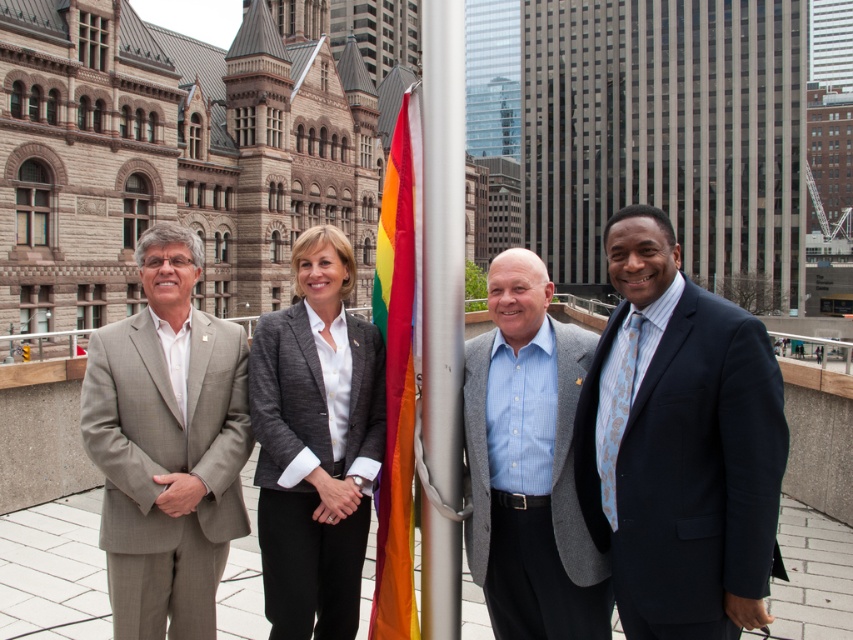
Does blue textured suit at right appear on the right side of brushed metal flag pole at center?

Yes, blue textured suit at right is to the right of brushed metal flag pole at center.

The width and height of the screenshot is (853, 640). In order to click on blue textured suit at right in this screenshot , I will do `click(679, 445)`.

Can you confirm if blue textured suit at right is wider than gray wool blazer at center?

Yes, blue textured suit at right is wider than gray wool blazer at center.

Is blue textured suit at right taller than gray wool blazer at center?

No.

Who is more forward, [666,589] or [354,509]?

Positioned in front is point [666,589].

Locate an element on the screen. The width and height of the screenshot is (853, 640). blue textured suit at right is located at coordinates tap(679, 445).

Is light brown suit at left bigger than rainbow fabric flag at center?

Correct, light brown suit at left is larger in size than rainbow fabric flag at center.

Who is more forward, (190, 316) or (403, 188)?

Positioned in front is point (403, 188).

Is point (175, 268) closer to viewer compared to point (387, 468)?

No.

The height and width of the screenshot is (640, 853). I want to click on light brown suit at left, so click(x=167, y=445).